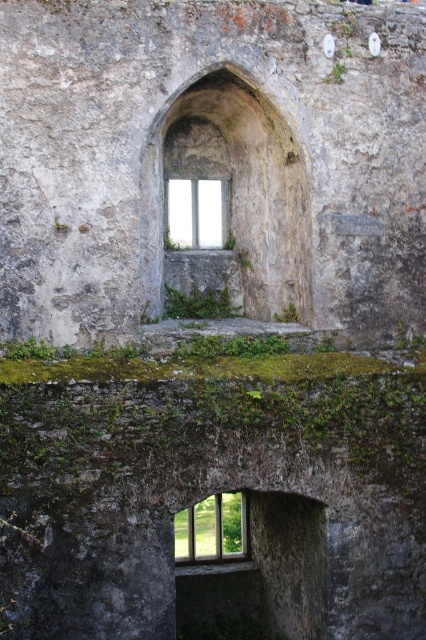
Between clear glass window at center and white glass window at upper center, which one has less height?

With less height is white glass window at upper center.

Can you confirm if clear glass window at center is positioned to the left of white glass window at upper center?

No, clear glass window at center is not to the left of white glass window at upper center.

Who is more forward, (215, 529) or (210, 225)?

Point (210, 225)

Find the location of `clear glass window at center`. clear glass window at center is located at coordinates (212, 529).